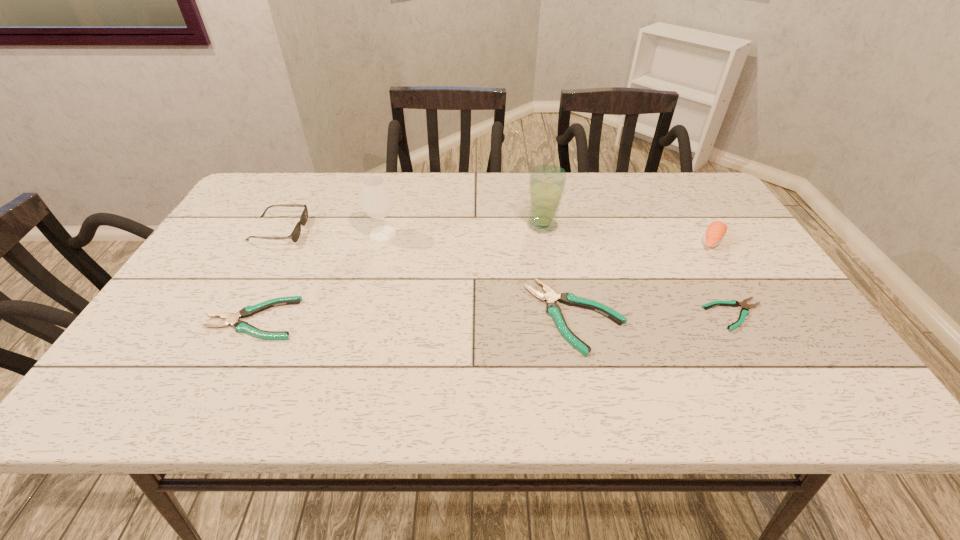
At what (x,y) coordinates should I click in order to perform the action: click on vacant space that's between the sunglasses and the second pliers from right to left. Please return your answer as a coordinate pair (x, y). Looking at the image, I should click on (427, 273).

Where is `free space that is in between the rightmost pliers and the right glass`? free space that is in between the rightmost pliers and the right glass is located at coordinates (638, 270).

You are a GUI agent. You are given a task and a screenshot of the screen. Output one action in this format:
    pyautogui.click(x=<x>, y=<y>)
    Task: Click on the free spot between the third tallest object and the fourth shortest object
    This screenshot has width=960, height=540.
    Given the screenshot: What is the action you would take?
    pyautogui.click(x=495, y=236)

Locate an element on the screen. This screenshot has height=540, width=960. vacant area that lies between the left glass and the second pliers from left to right is located at coordinates (479, 275).

You are a GUI agent. You are given a task and a screenshot of the screen. Output one action in this format:
    pyautogui.click(x=<x>, y=<y>)
    Task: Click on the vacant area that lies between the sunglasses and the right glass
    Image resolution: width=960 pixels, height=540 pixels.
    Given the screenshot: What is the action you would take?
    pyautogui.click(x=411, y=228)

The width and height of the screenshot is (960, 540). In order to click on vacant space that is in between the second pliers from left to right and the fifth object from right to left in this screenshot , I will do `click(479, 275)`.

The width and height of the screenshot is (960, 540). Identify the location of free spot between the fourth shortest object and the leftmost pliers. tap(266, 275).

Select which object appears as the sixth closest to the right glass. Please provide its 2D coordinates. Your answer should be formatted as a tuple, i.e. [(x, y)], where the tuple contains the x and y coordinates of a point satisfying the conditions above.

[(295, 234)]

Select which object appears as the second closest to the second pliers from right to left. Please provide its 2D coordinates. Your answer should be formatted as a tuple, i.e. [(x, y)], where the tuple contains the x and y coordinates of a point satisfying the conditions above.

[(744, 312)]

Point out which pliers is positioned as the nearest to the sunglasses. Please provide its 2D coordinates. Your answer should be formatted as a tuple, i.e. [(x, y)], where the tuple contains the x and y coordinates of a point satisfying the conditions above.

[(232, 319)]